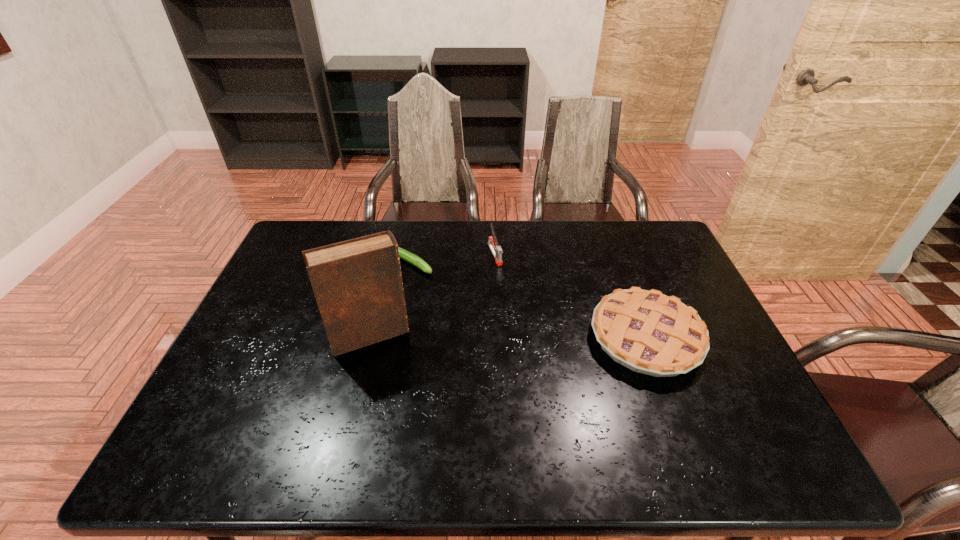
Where is `the tallest object`? This screenshot has width=960, height=540. the tallest object is located at coordinates (357, 283).

You are a GUI agent. You are given a task and a screenshot of the screen. Output one action in this format:
    pyautogui.click(x=<x>, y=<y>)
    Task: Click on the rightmost object
    The width and height of the screenshot is (960, 540).
    Given the screenshot: What is the action you would take?
    pyautogui.click(x=648, y=332)

The width and height of the screenshot is (960, 540). I want to click on pie, so click(x=648, y=332).

The image size is (960, 540). I want to click on the shortest object, so click(403, 254).

The width and height of the screenshot is (960, 540). Identify the location of stapler. (496, 250).

This screenshot has height=540, width=960. In order to click on the third object from left to right in this screenshot , I will do `click(496, 250)`.

Locate an element on the screen. blank area located on the back of the Bible is located at coordinates (394, 238).

Identify the location of vacant space located 0.210m on the left of the third tallest object. (513, 338).

The image size is (960, 540). Identify the location of free space located 0.400m on the front-facing side of the shortest object. (533, 328).

The height and width of the screenshot is (540, 960). What are the coordinates of `vacant space located on the front-facing side of the shortest object` in the screenshot? It's located at (448, 282).